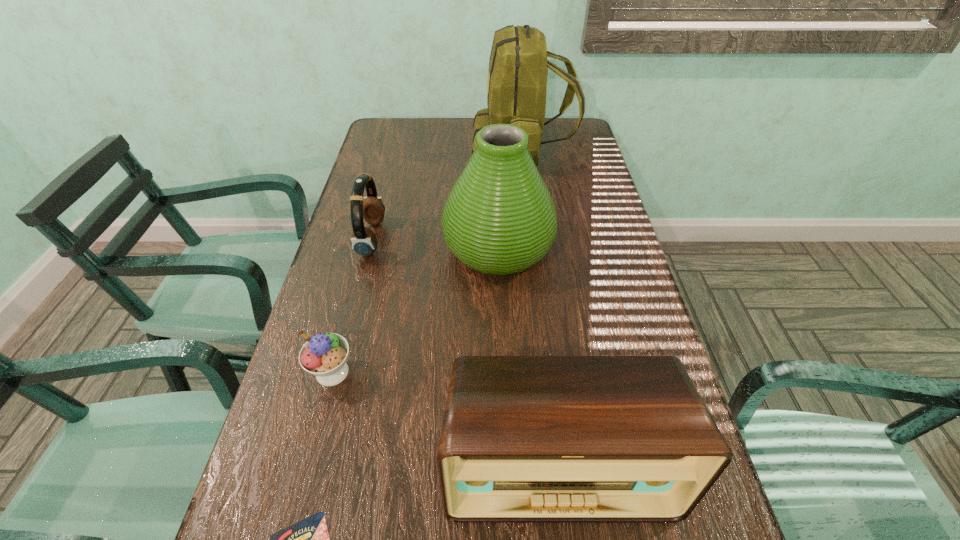
I want to click on the tallest object, so click(x=518, y=67).

What are the coordinates of `backpack` in the screenshot? It's located at (518, 67).

At what (x,y) coordinates should I click in order to perform the action: click on the second tallest object. Please return your answer as a coordinate pair (x, y). Image resolution: width=960 pixels, height=540 pixels. Looking at the image, I should click on (499, 218).

Locate an element on the screen. Image resolution: width=960 pixels, height=540 pixels. radio receiver is located at coordinates (525, 439).

Identify the location of the fourth tallest object. Image resolution: width=960 pixels, height=540 pixels. (364, 242).

Locate an element on the screen. The width and height of the screenshot is (960, 540). icecream is located at coordinates (324, 355).

This screenshot has width=960, height=540. I want to click on the fourth farthest object, so click(324, 355).

At what (x,y) coordinates should I click in order to perform the action: click on vacant space situated on the front-facing side of the tallest object. Please return your answer as a coordinate pair (x, y). Image resolution: width=960 pixels, height=540 pixels. Looking at the image, I should click on (414, 149).

At what (x,y) coordinates should I click in order to perform the action: click on free location located 0.340m on the front-facing side of the tallest object. Please return your answer as a coordinate pair (x, y). The width and height of the screenshot is (960, 540). Looking at the image, I should click on (377, 149).

Locate an element on the screen. The height and width of the screenshot is (540, 960). blank space located on the front-facing side of the tallest object is located at coordinates (377, 149).